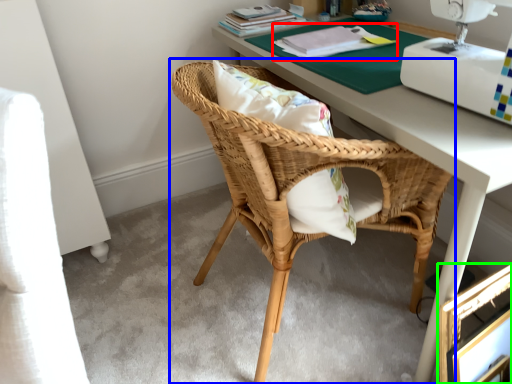
Question: Estimate the real-world distances between objects in this image. Which object is closer to book (highlighted by a red box), chair (highlighted by a blue box) or picture frame (highlighted by a green box)?

Choices:
 (A) chair
 (B) picture frame

Answer: (A)